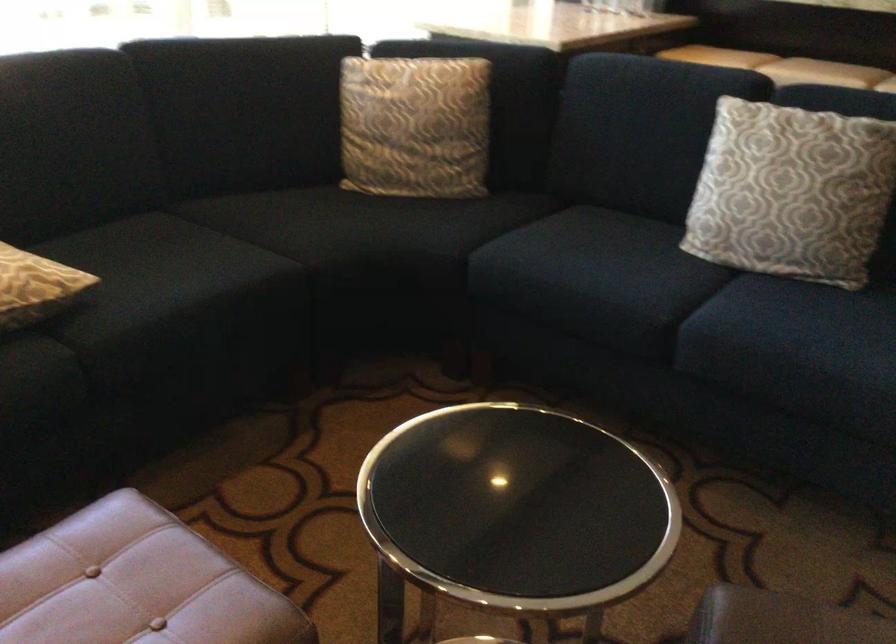
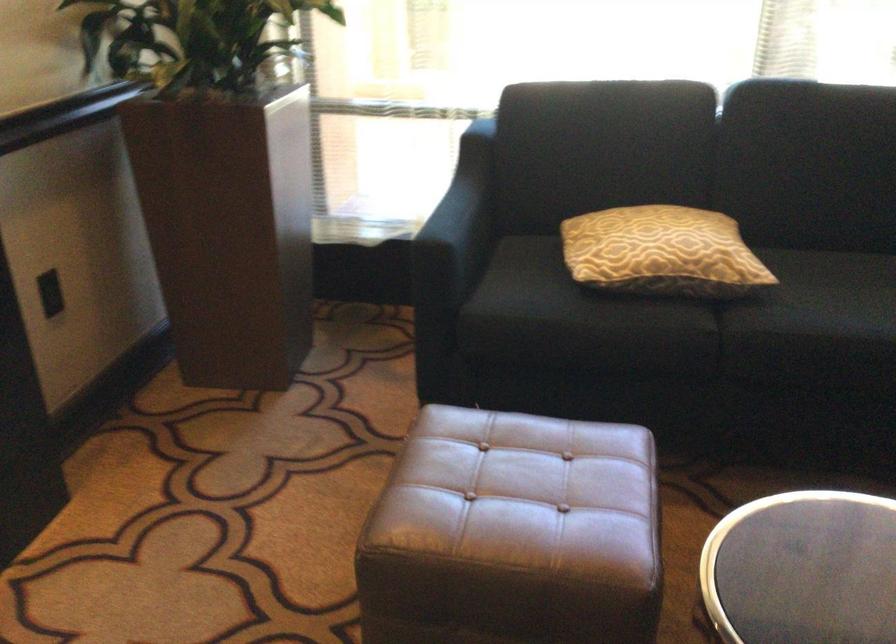
In the second image, find the point that corresponds to point 82,295 in the first image.

(752, 289)